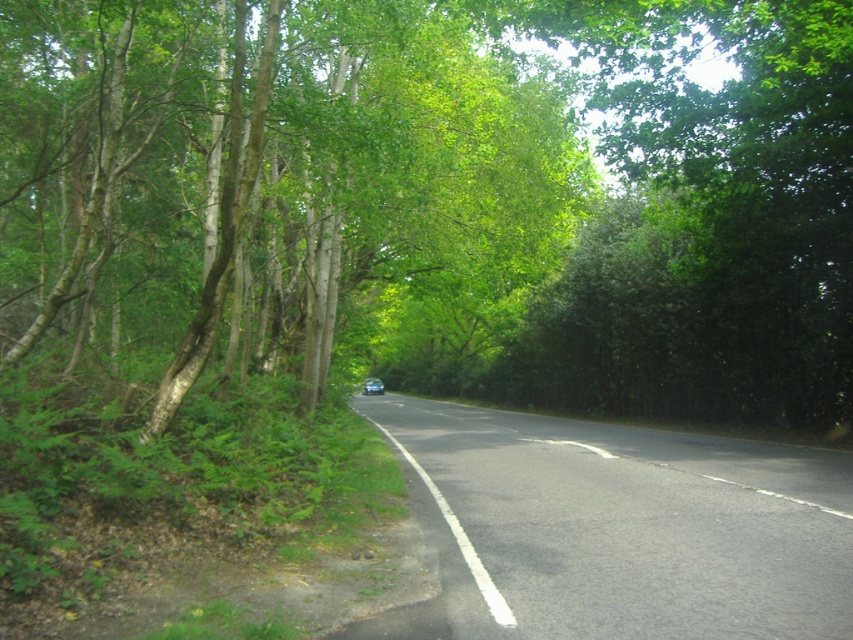
Is point (505, 461) closer to viewer compared to point (378, 380)?

Yes, point (505, 461) is closer to viewer.

Is black asphalt road at center in front of metallic blue car at center?

Yes, black asphalt road at center is closer to the viewer.

Between point (846, 554) and point (370, 387), which one is positioned in front?

Positioned in front is point (846, 554).

Locate an element on the screen. This screenshot has height=640, width=853. black asphalt road at center is located at coordinates (624, 525).

Who is taller, green leafy tree at center or metallic blue car at center?

green leafy tree at center

Does green leafy tree at center have a greater height compared to metallic blue car at center?

Correct, green leafy tree at center is much taller as metallic blue car at center.

Is point (241, 189) less distant than point (369, 384)?

Yes.

Where is `green leafy tree at center`? This screenshot has height=640, width=853. green leafy tree at center is located at coordinates (434, 200).

Between green leafy tree at center and black asphalt road at center, which one is positioned higher?

green leafy tree at center

Can you confirm if green leafy tree at center is positioned below black asphalt road at center?

No.

The height and width of the screenshot is (640, 853). I want to click on green leafy tree at center, so click(x=434, y=200).

You are a GUI agent. You are given a task and a screenshot of the screen. Output one action in this format:
    pyautogui.click(x=<x>, y=<y>)
    Task: Click on the green leafy tree at center
    The image size is (853, 640).
    Given the screenshot: What is the action you would take?
    click(x=434, y=200)